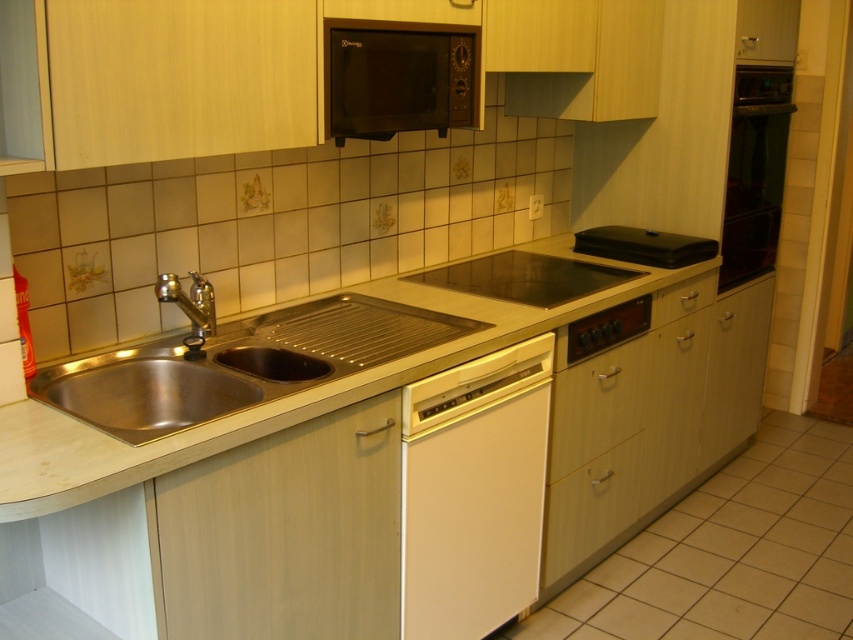
You are organizing the kitchen and need to place a tall utensil holder. Which drawer between the wooden drawer at lower center and the wooden drawer at right can accommodate it based on their heights?

The wooden drawer at lower center is taller than the wooden drawer at right, so the utensil holder should fit better in the wooden drawer at lower center.

You are organizing kitchen items and need to place a large pot that requires 30 cm of space. You have two wooden drawers available in the kitchen scene. Which wooden drawer should you choose between the wooden drawer at lower center and the wooden drawer at right to ensure the pot fits?

The wooden drawer at lower center has a greater width than the wooden drawer at right, so the large pot requiring 30 cm of space would fit better in the wooden drawer at lower center.

You need to place a new appliance that requires more space than the existing ones. Which appliance should you consider replacing between the stainless steel sink at left and the black matte microwave at upper center?

The stainless steel sink at left has a larger size compared to the black matte microwave at upper center, so you should consider replacing the black matte microwave at upper center to accommodate the new appliance that needs more space.